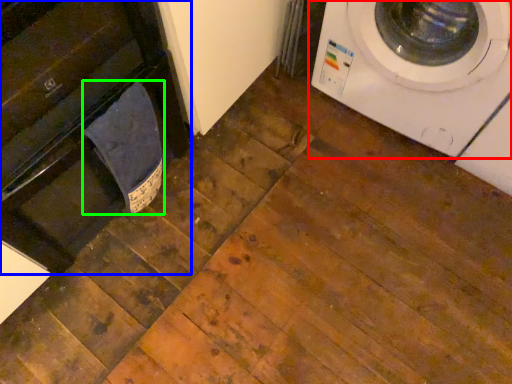
Question: Which object is positioned farthest from washing machine (highlighted by a red box)? Select from dish washer (highlighted by a blue box) and laundry (highlighted by a green box).

Choices:
 (A) dish washer
 (B) laundry

Answer: (A)